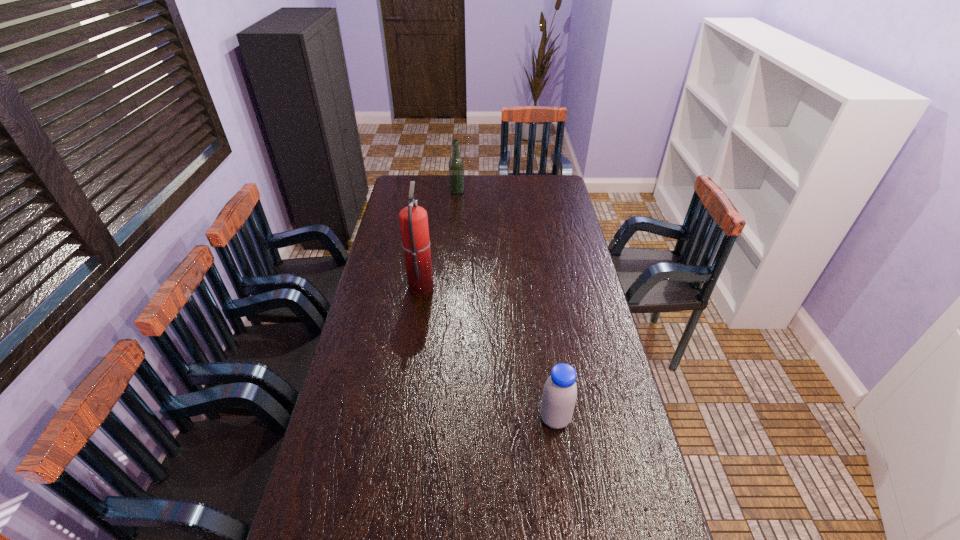
At what (x,y) coordinates should I click in order to perform the action: click on the second closest object to the nearest object. Please return your answer as a coordinate pair (x, y). The width and height of the screenshot is (960, 540). Looking at the image, I should click on (456, 167).

Identify the location of free location that satisfies the following two spatial constraints: 1. with the nozzle and gauge on the fire extinguisher; 2. on the back side of the soya milk. (401, 418).

At what (x,y) coordinates should I click in order to perform the action: click on blank space that satisfies the following two spatial constraints: 1. on the back side of the nearest object; 2. with the nozzle and gauge on the tallest object. Please return your answer as a coordinate pair (x, y). Image resolution: width=960 pixels, height=540 pixels. Looking at the image, I should click on (536, 285).

Locate an element on the screen. blank space that satisfies the following two spatial constraints: 1. with the nozzle and gauge on the shortest object; 2. on the right side of the leftmost object is located at coordinates (401, 418).

This screenshot has width=960, height=540. In order to click on vacant point that satisfies the following two spatial constraints: 1. with the nozzle and gauge on the leftmost object; 2. on the right side of the shortest object in this screenshot , I will do `click(401, 418)`.